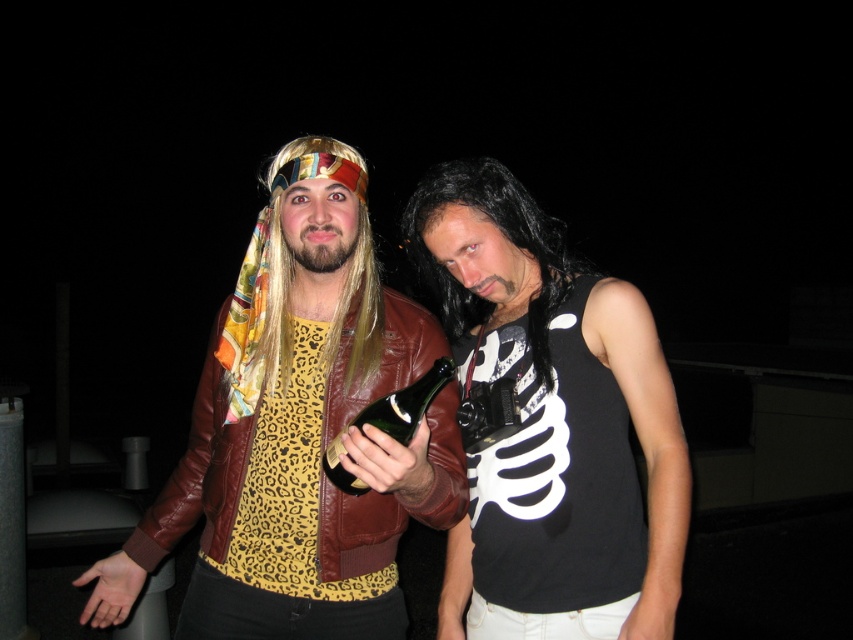
Question: Estimate the real-world distances between objects in this image. Which object is farther from the leather jacket at center?

Choices:
 (A) black silky hair at center
 (B) green glass bottle at center
 (C) black matte tank top at center

Answer: (A)

Question: Which object is closer to the camera taking this photo?

Choices:
 (A) leather jacket at center
 (B) black matte tank top at center

Answer: (A)

Question: Where is leather jacket at center located in relation to black silky hair at center in the image?

Choices:
 (A) left
 (B) right

Answer: (A)

Question: Is the position of leather jacket at center more distant than that of green glass bottle at center?

Choices:
 (A) yes
 (B) no

Answer: (B)

Question: Which object is the closest to the black silky hair at center?

Choices:
 (A) black matte tank top at center
 (B) leather jacket at center
 (C) green glass bottle at center

Answer: (A)

Question: From the image, what is the correct spatial relationship of leather jacket at center in relation to black matte tank top at center?

Choices:
 (A) right
 (B) left

Answer: (B)